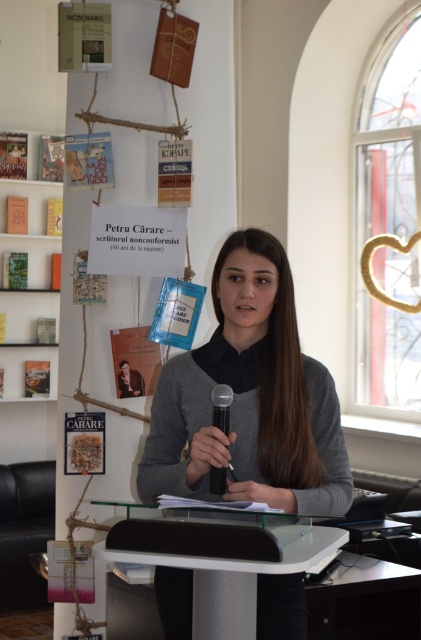
Can you confirm if gray matte sweater at center is shorter than white glossy table at center?

Incorrect, gray matte sweater at center's height does not fall short of white glossy table at center's.

Can you confirm if gray matte sweater at center is positioned above white glossy table at center?

Correct, gray matte sweater at center is located above white glossy table at center.

Find the location of a particular element. gray matte sweater at center is located at coordinates (250, 396).

Where is `gray matte sweater at center`? This screenshot has height=640, width=421. gray matte sweater at center is located at coordinates (250, 396).

Who is positioned more to the left, gray matte sweater at center or black plastic microphone at center?

black plastic microphone at center is more to the left.

Does gray matte sweater at center have a smaller size compared to black plastic microphone at center?

Incorrect, gray matte sweater at center is not smaller in size than black plastic microphone at center.

Is point (191, 486) closer to camera compared to point (218, 384)?

Yes, point (191, 486) is in front of point (218, 384).

Locate an element on the screen. This screenshot has height=640, width=421. gray matte sweater at center is located at coordinates (250, 396).

Is gray matte sweater at center closer to the viewer compared to white wooden bookshelf at left?

Yes, it is in front of white wooden bookshelf at left.

Between gray matte sweater at center and white wooden bookshelf at left, which one is positioned lower?

gray matte sweater at center

Describe the element at coordinates (250, 396) in the screenshot. The width and height of the screenshot is (421, 640). I see `gray matte sweater at center` at that location.

Find the location of a particular element. The image size is (421, 640). gray matte sweater at center is located at coordinates (250, 396).